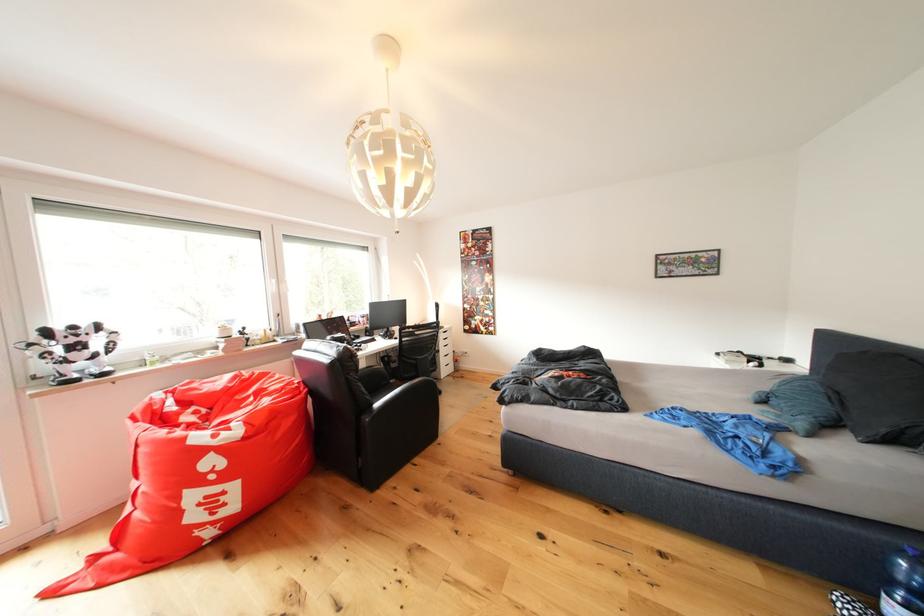
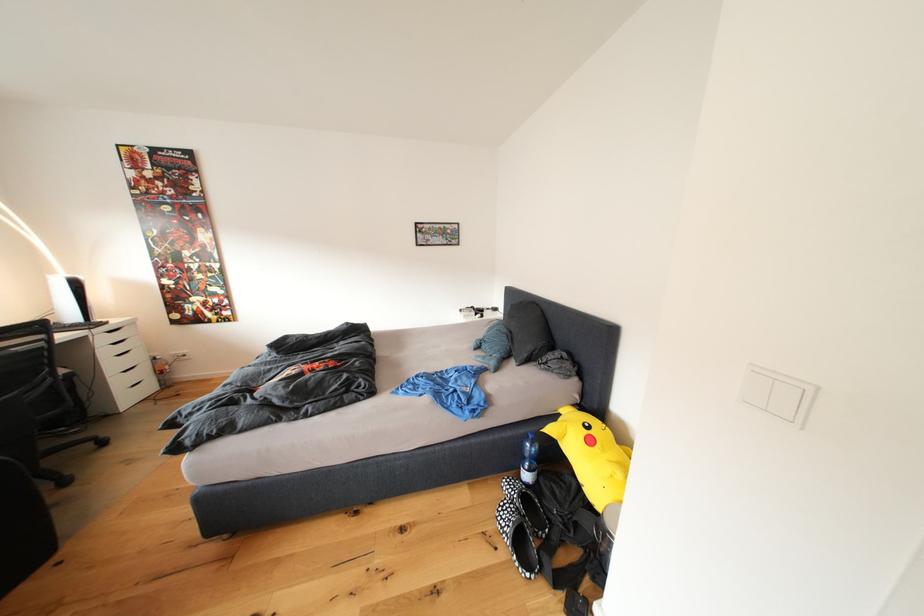
Where in the second image is the point corresponding to [458,363] from the first image?

(152, 379)